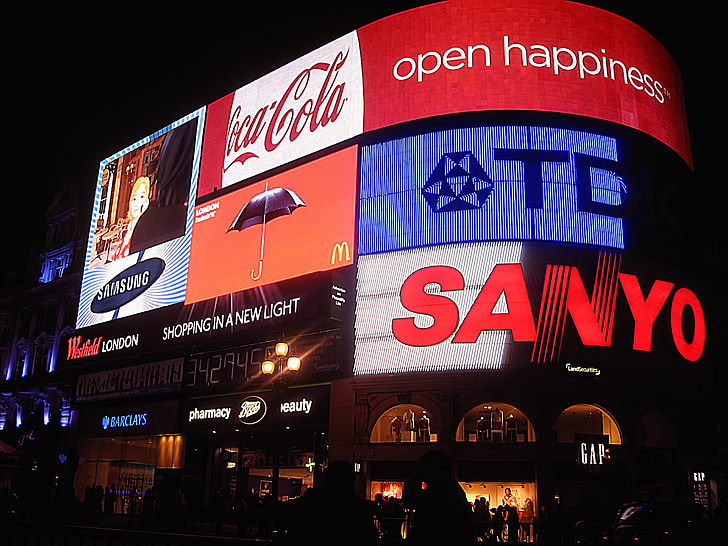
The height and width of the screenshot is (546, 728). I want to click on window, so click(x=392, y=420), click(x=499, y=427), click(x=585, y=420), click(x=135, y=485), click(x=274, y=485).